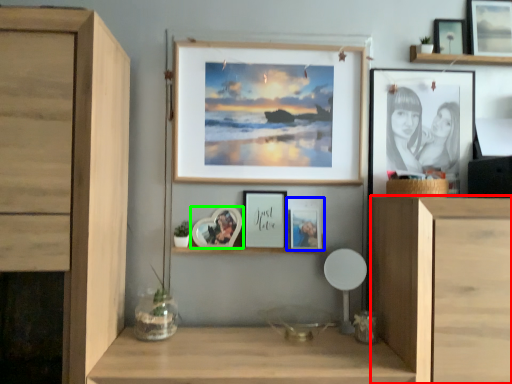
Question: Estimate the real-world distances between objects in this image. Which object is farther from cabinetry (highlighted by a red box), picture frame (highlighted by a blue box) or picture frame (highlighted by a green box)?

Choices:
 (A) picture frame
 (B) picture frame

Answer: (B)